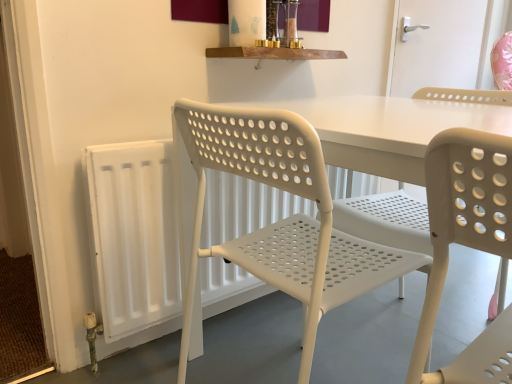
Question: From the image's perspective, is white plastic chair at left under white plastic door handle at upper right?

Choices:
 (A) yes
 (B) no

Answer: (A)

Question: From the image's perspective, would you say white plastic chair at left is positioned over white plastic door handle at upper right?

Choices:
 (A) no
 (B) yes

Answer: (A)

Question: Is white plastic chair at left outside of white plastic door handle at upper right?

Choices:
 (A) yes
 (B) no

Answer: (A)

Question: Is white plastic chair at left wider than white plastic door handle at upper right?

Choices:
 (A) no
 (B) yes

Answer: (B)

Question: Is white plastic chair at left turned away from white plastic door handle at upper right?

Choices:
 (A) yes
 (B) no

Answer: (B)

Question: From a real-world perspective, is white plastic chair at left positioned above or below white plastic door handle at upper right?

Choices:
 (A) below
 (B) above

Answer: (A)

Question: Looking at the image, does white plastic chair at left seem bigger or smaller compared to white plastic door handle at upper right?

Choices:
 (A) small
 (B) big

Answer: (B)

Question: Choose the correct answer: Is white plastic chair at left inside white plastic door handle at upper right or outside it?

Choices:
 (A) inside
 (B) outside

Answer: (B)

Question: From the image's perspective, is white plastic chair at left located above or below white plastic door handle at upper right?

Choices:
 (A) above
 (B) below

Answer: (B)

Question: Based on their sizes in the image, would you say white plastic chair at left is bigger or smaller than white plastic radiator at left?

Choices:
 (A) big
 (B) small

Answer: (A)

Question: Looking at their shapes, would you say white plastic chair at left is wider or thinner than white plastic radiator at left?

Choices:
 (A) thin
 (B) wide

Answer: (B)

Question: Do you think white plastic chair at left is within white plastic radiator at left, or outside of it?

Choices:
 (A) inside
 (B) outside

Answer: (B)

Question: From the image's perspective, relative to white plastic radiator at left, is white plastic chair at left above or below?

Choices:
 (A) above
 (B) below

Answer: (B)

Question: Which is correct: white plastic door handle at upper right is inside white plastic chair at left, or outside of it?

Choices:
 (A) inside
 (B) outside

Answer: (B)

Question: Looking at their shapes, would you say white plastic door handle at upper right is wider or thinner than white plastic chair at left?

Choices:
 (A) wide
 (B) thin

Answer: (B)